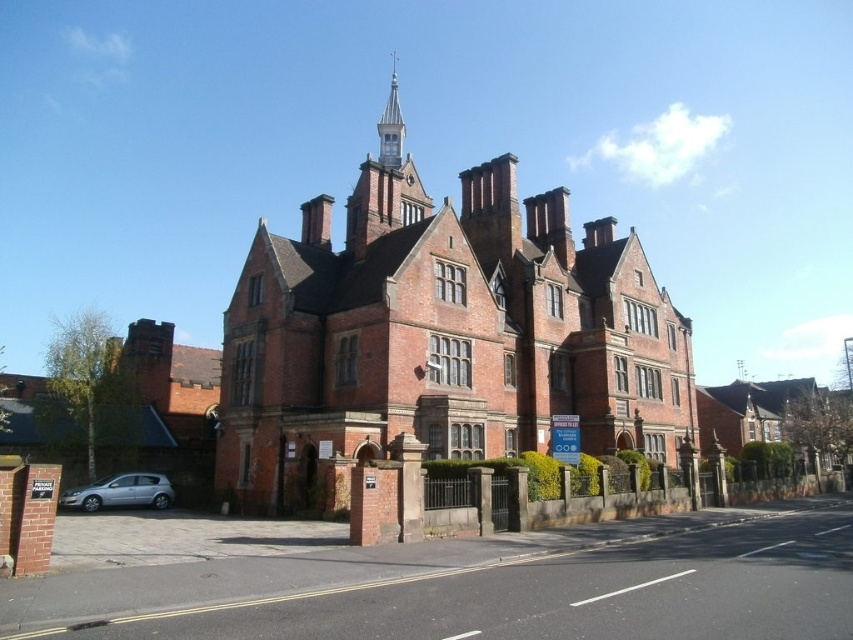
You are a delivery driver approaching the red brick church at center and the silver metallic hatchback at lower left. Which object is closer to you as you arrive?

The red brick church at center is closer to you because it is in front of the silver metallic hatchback at lower left, meaning the church is positioned nearer to your viewpoint.

You are standing in front of the historic building and want to take a photo that includes the point at coordinates point (x=483, y=166). Given that the camera has a maximum focus range of 80 meters, will the point be in focus?

The point (x=483, y=166) is 85.89 meters from the camera, which exceeds the maximum focus range of 80 meters. Therefore, the point will not be in focus.

You are a photographer standing at the entrance of the building. You want to capture a photo of the silver metallic hatchback at lower left and the silver metallic spire at upper center in the same frame. Which object will appear taller in the photo?

The silver metallic spire at upper center will appear taller in the photo because the silver metallic hatchback at lower left has a lesser height compared to it.